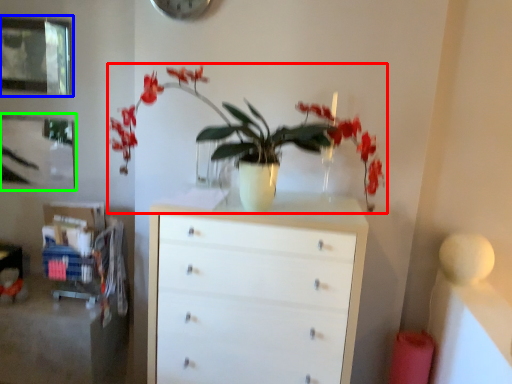
Question: Which is nearer to the houseplant (highlighted by a red box)? picture frame (highlighted by a blue box) or picture frame (highlighted by a green box).

Choices:
 (A) picture frame
 (B) picture frame

Answer: (B)